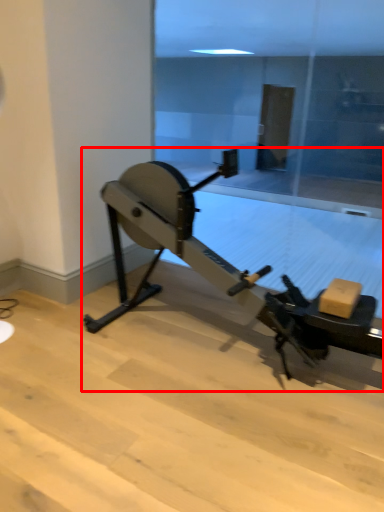
Question: From the image's perspective, considering the relative positions of stationary bicycle (annotated by the red box) and glass door in the image provided, where is stationary bicycle (annotated by the red box) located with respect to the staircase?

Choices:
 (A) below
 (B) above

Answer: (A)